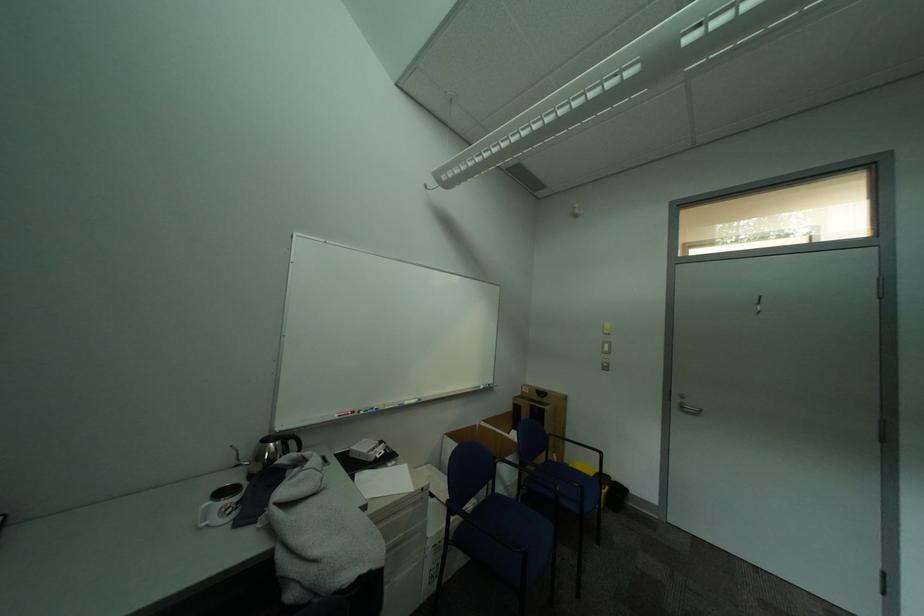
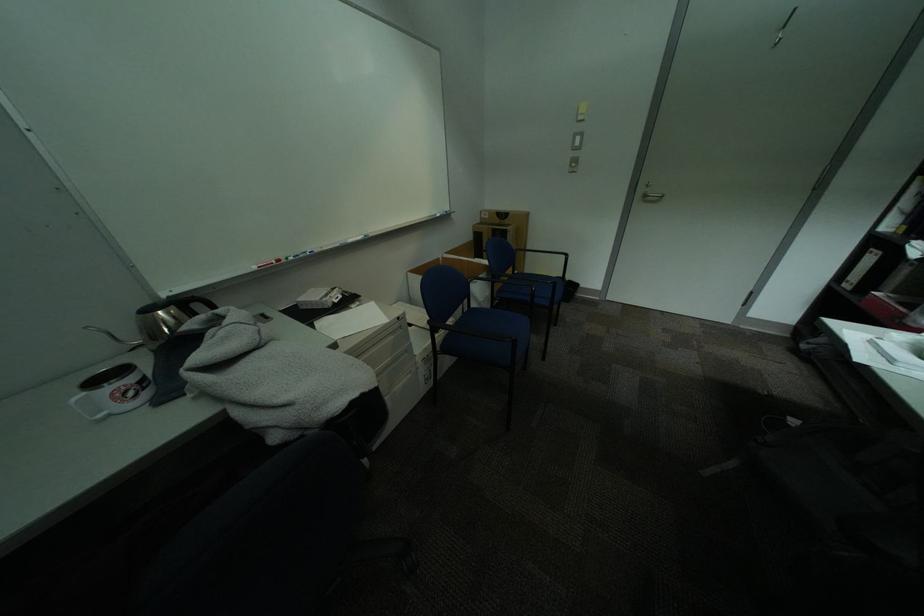
Locate, in the second image, the point that corresponds to point (487, 426) in the first image.

(450, 259)